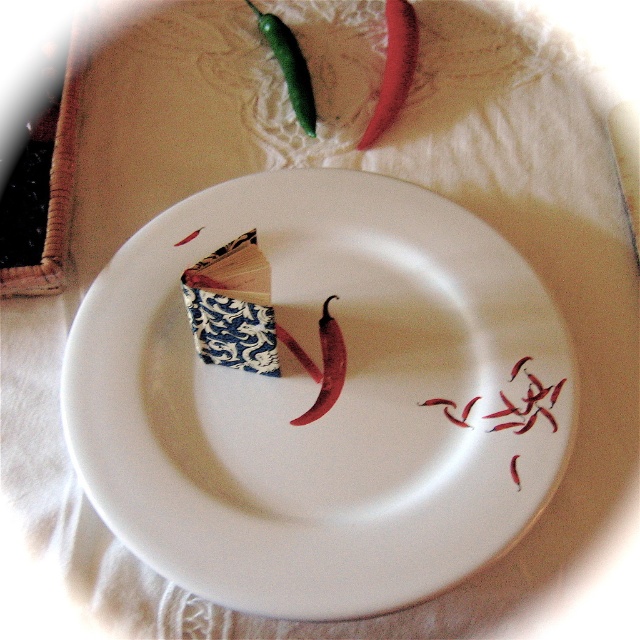
Is red matte chili peppers at lower right positioned before smooth red pepper at center?

Yes, it is in front of smooth red pepper at center.

What do you see at coordinates (525, 403) in the screenshot? This screenshot has width=640, height=640. I see `red matte chili peppers at lower right` at bounding box center [525, 403].

This screenshot has height=640, width=640. Find the location of `red matte chili peppers at lower right`. red matte chili peppers at lower right is located at coordinates (525, 403).

Between point (397, 88) and point (515, 428), which one is positioned behind?

Point (397, 88)

Does point (390, 115) lie in front of point (540, 396)?

No, it is behind (540, 396).

Is point (406, 42) positioned after point (550, 397)?

Yes.

Where is `smooth red pepper at upper center`? This screenshot has height=640, width=640. smooth red pepper at upper center is located at coordinates (394, 68).

Between point (371, 445) and point (397, 29), which one is positioned behind?

Point (397, 29)

Is point (422, 276) behind point (387, 124)?

No, (422, 276) is closer to viewer.

Describe the element at coordinates (314, 397) in the screenshot. I see `white glossy plate at center` at that location.

Locate an element on the screen. white glossy plate at center is located at coordinates (314, 397).